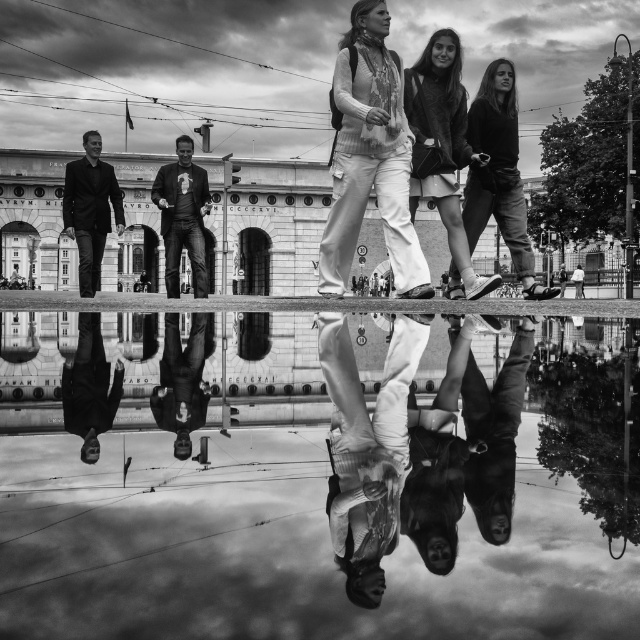
Question: Among these objects, which one is nearest to the camera?

Choices:
 (A) smooth black suit at left
 (B) smooth leather shoes at center
 (C) matte black jacket at upper right
 (D) smooth leather shoes at lower left

Answer: (D)

Question: Can you confirm if smooth white pants at center is positioned below smooth leather bag at center?

Choices:
 (A) no
 (B) yes

Answer: (B)

Question: Does matte white pants at center have a larger size compared to smooth white pants at center?

Choices:
 (A) yes
 (B) no

Answer: (A)

Question: Which is farther from the smooth white pants at center?

Choices:
 (A) smooth leather shoes at lower left
 (B) smooth leather shoe at lower right

Answer: (A)

Question: Which point is farther to the camera?

Choices:
 (A) smooth leather shoe at lower right
 (B) smooth white pants at center
 (C) smooth leather jacket at center
 (D) matte black jacket at right

Answer: (C)

Question: Does matte black jacket at upper right appear on the left side of smooth leather jacket at center?

Choices:
 (A) no
 (B) yes

Answer: (A)